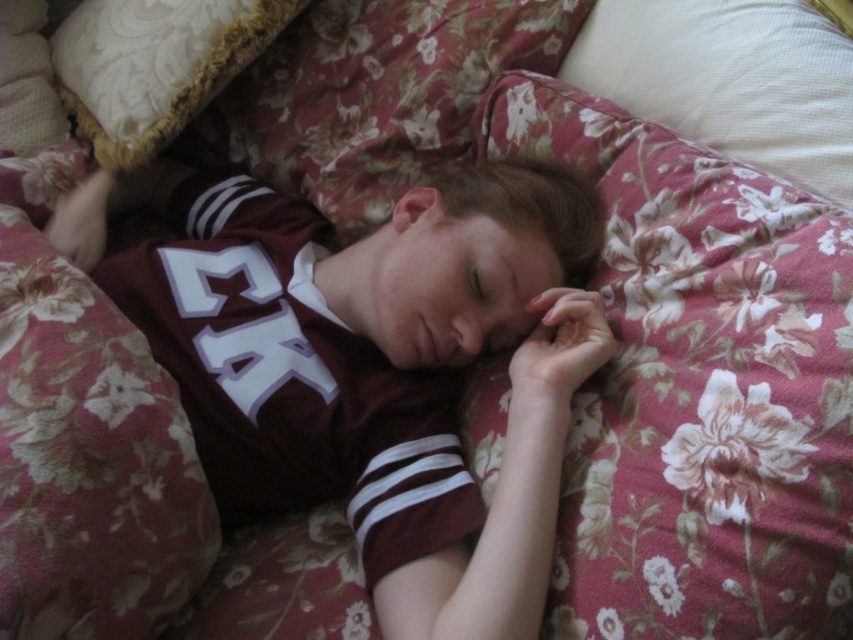
Question: Does maroon jersey at center have a lesser width compared to white textured pillow at upper right?

Choices:
 (A) yes
 (B) no

Answer: (B)

Question: Which object appears closest to the camera in this image?

Choices:
 (A) floral fabric at upper center
 (B) white textured pillow at upper right

Answer: (A)

Question: Does white textured pillow at upper right have a larger size compared to velvet-like beige pillow at upper left?

Choices:
 (A) no
 (B) yes

Answer: (B)

Question: Which point is closer to the camera?

Choices:
 (A) white textured pillow at upper right
 (B) maroon jersey at center
 (C) floral fabric at upper center
 (D) velvet-like beige pillow at upper left

Answer: (C)

Question: Observing the image, what is the correct spatial positioning of floral fabric at upper center in reference to velvet-like beige pillow at upper left?

Choices:
 (A) above
 (B) below

Answer: (B)

Question: Which of the following is the farthest from the observer?

Choices:
 (A) (288, 348)
 (B) (817, 180)
 (C) (672, 253)
 (D) (170, 129)

Answer: (D)